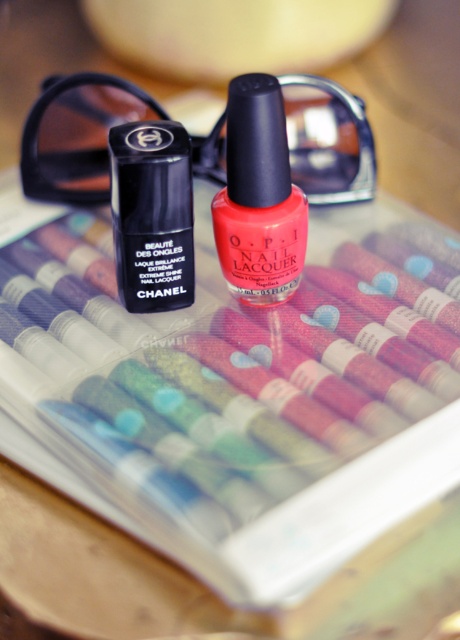
Is shiny coral nail polish at center taller than matte black nail polish at center?

Yes, shiny coral nail polish at center is taller than matte black nail polish at center.

Consider the image. Can you confirm if shiny coral nail polish at center is positioned to the left of matte black nail polish at center?

In fact, shiny coral nail polish at center is to the right of matte black nail polish at center.

Where is `shiny coral nail polish at center`? The width and height of the screenshot is (460, 640). shiny coral nail polish at center is located at coordinates (258, 196).

Is the position of black plastic goggles at center less distant than that of matte black nail polish at center?

Yes, it is.

Find the location of a particular element. The height and width of the screenshot is (640, 460). black plastic goggles at center is located at coordinates (78, 134).

The height and width of the screenshot is (640, 460). Identify the location of black plastic goggles at center. (78, 134).

Who is taller, black plastic goggles at center or shiny coral nail polish at center?

shiny coral nail polish at center is taller.

Is black plastic goggles at center to the left of shiny coral nail polish at center from the viewer's perspective?

Correct, you'll find black plastic goggles at center to the left of shiny coral nail polish at center.

Between point (326, 109) and point (245, 186), which one is positioned in front?

Point (245, 186)

Identify the location of black plastic goggles at center. This screenshot has width=460, height=640. (78, 134).